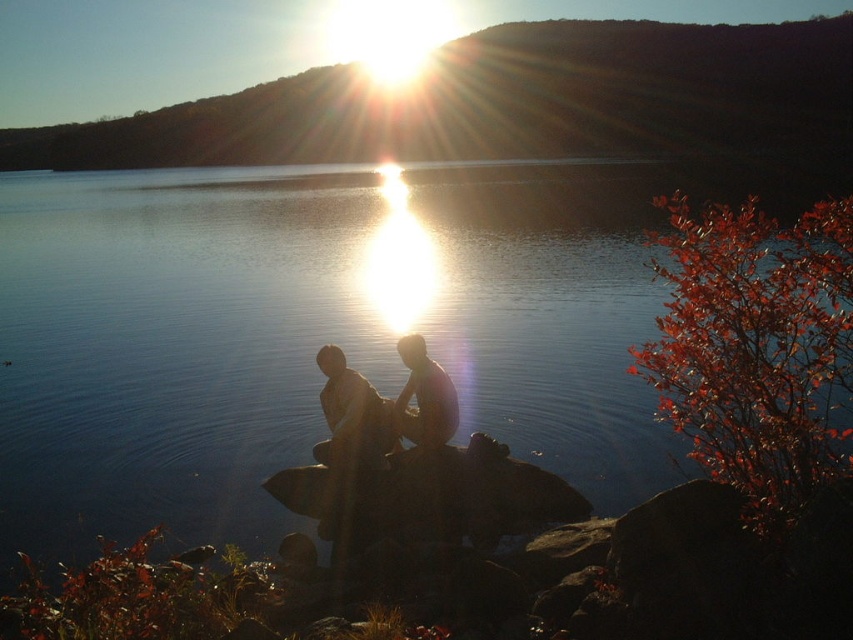
Question: Which of the following is the closest to the observer?

Choices:
 (A) transparent water at center
 (B) smooth skin man at center

Answer: (A)

Question: Considering the relative positions of matte brown couple at center and smooth skin man at center in the image provided, where is matte brown couple at center located with respect to smooth skin man at center?

Choices:
 (A) below
 (B) above

Answer: (A)

Question: Which point is farther from the camera taking this photo?

Choices:
 (A) (302, 289)
 (B) (440, 413)
 (C) (412, 337)

Answer: (A)

Question: Can you confirm if matte brown couple at center is positioned to the left of smooth skin man at center?

Choices:
 (A) yes
 (B) no

Answer: (A)

Question: Can you confirm if matte brown couple at center is positioned above smooth skin man at center?

Choices:
 (A) no
 (B) yes

Answer: (A)

Question: Which of these objects is positioned farthest from the smooth skin man at center?

Choices:
 (A) matte brown couple at center
 (B) transparent water at center

Answer: (B)